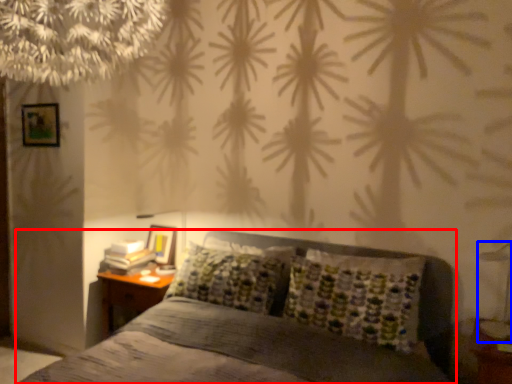
Question: Which of the following is the closest to the observer, bed (highlighted by a red box) or bedside lamp (highlighted by a blue box)?

Choices:
 (A) bed
 (B) bedside lamp

Answer: (A)